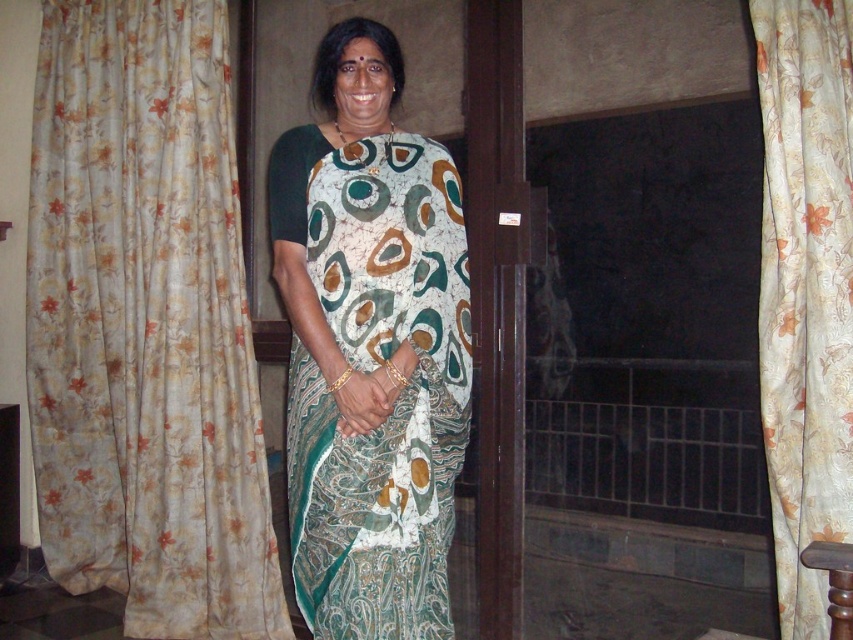
Between point (466, 420) and point (822, 323), which one is positioned in front?

Point (822, 323)

Is point (343, 492) closer to viewer compared to point (810, 260)?

Yes.

I want to click on printed silk saree at center, so click(x=370, y=374).

Where is `printed silk saree at center`? Image resolution: width=853 pixels, height=640 pixels. printed silk saree at center is located at coordinates (370, 374).

Looking at this image, between floral fabric curtain at left and floral silk curtain at right, which one has more height?

Standing taller between the two is floral fabric curtain at left.

Between floral fabric curtain at left and floral silk curtain at right, which one appears on the left side from the viewer's perspective?

Positioned to the left is floral fabric curtain at left.

Is point (218, 113) behind point (804, 481)?

Yes, it is behind point (804, 481).

Identify the location of floral fabric curtain at left. (144, 324).

Which is behind, point (109, 276) or point (352, 508)?

The point (109, 276) is behind.

Is floral fabric curtain at left bigger than printed silk saree at center?

Yes.

Find the location of a particular element. floral fabric curtain at left is located at coordinates (144, 324).